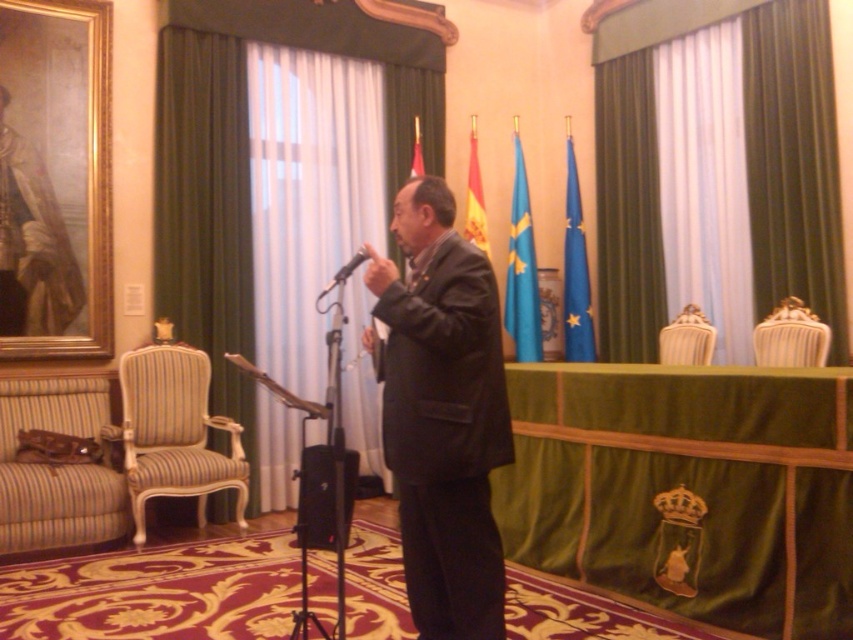
You are an event planner arranging seating for attendees. You need to place a new chair behind the existing striped fabric armchair at right. Considering the current setup, where should the new chair be placed relative to the black matte speaker at center?

The black matte speaker at center is in front of the striped fabric armchair at right, so the new chair should be placed behind the black matte speaker at center to maintain the spatial relationship.

You are a technician setting up a live stream for the event. The camera needs to be positioned exactly 3 meters away from the black matte speaker at center to capture the best angle. Based on the current setup, is the camera positioned correctly?

The black matte speaker at center and camera are 2.59 meters apart from each other. Since 2.59 meters is less than 3 meters, the camera is too close and needs to be moved back to meet the required distance.

You are an event planner arranging seating for attendees. The striped fabric armchair at right is currently placed where in relation to the black matte microphone at center? Please describe its position relative to the microphone.

The striped fabric armchair at right is positioned under the black matte microphone at center, meaning it is directly below the microphone in the image.